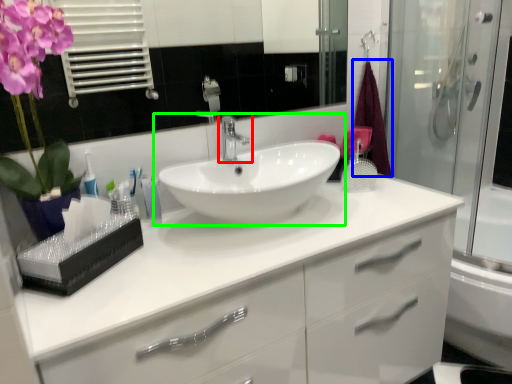
Question: Which object is positioned farthest from tap (highlighted by a red box)? Select from bath towel (highlighted by a blue box) and sink (highlighted by a green box).

Choices:
 (A) bath towel
 (B) sink

Answer: (A)